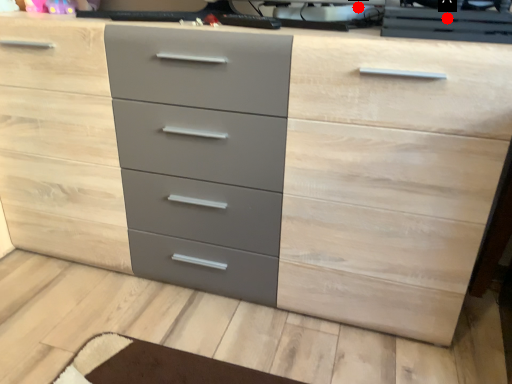
Question: Two points are circled on the image, labeled by A and B beside each circle. Among these points, which one is nearest to the camera?

Choices:
 (A) A is closer
 (B) B is closer

Answer: (A)